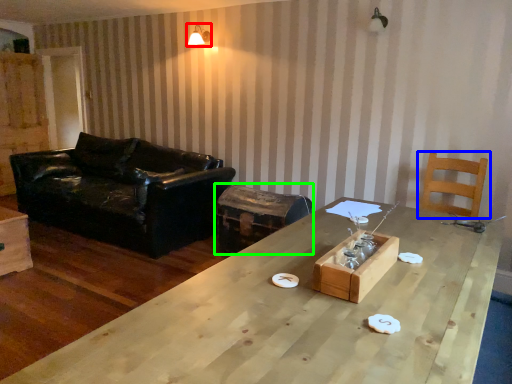
Question: Which object is the closest to the light fixture (highlighted by a red box)? Choose among these: chair (highlighted by a blue box) or swivel chair (highlighted by a green box).

Choices:
 (A) chair
 (B) swivel chair

Answer: (B)